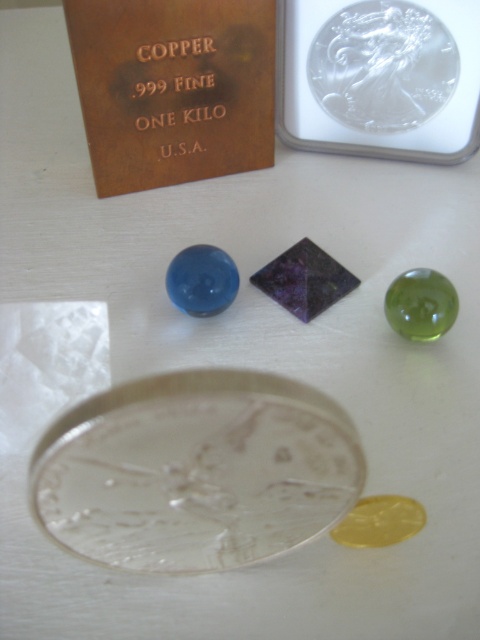
Is copper metallic plaque at upper left taller than clear glass coin at upper center?

Yes, copper metallic plaque at upper left is taller than clear glass coin at upper center.

Who is more distant from viewer, [236,33] or [429,83]?

Positioned behind is point [429,83].

This screenshot has height=640, width=480. Find the location of `copper metallic plaque at upper left`. copper metallic plaque at upper left is located at coordinates (172, 88).

What do you see at coordinates (195, 472) in the screenshot? Image resolution: width=480 pixels, height=640 pixels. I see `clear glass coin at center` at bounding box center [195, 472].

At what (x,y) coordinates should I click in order to perform the action: click on clear glass coin at center. Please return your answer as a coordinate pair (x, y). The height and width of the screenshot is (640, 480). Looking at the image, I should click on (195, 472).

This screenshot has height=640, width=480. In order to click on clear glass coin at center in this screenshot , I will do `click(195, 472)`.

Does clear glass coin at center appear on the left side of copper metallic plaque at upper left?

In fact, clear glass coin at center is to the right of copper metallic plaque at upper left.

Is point (268, 547) more distant than point (145, 67)?

No, it is in front of (145, 67).

Find the location of `clear glass coin at center`. clear glass coin at center is located at coordinates (195, 472).